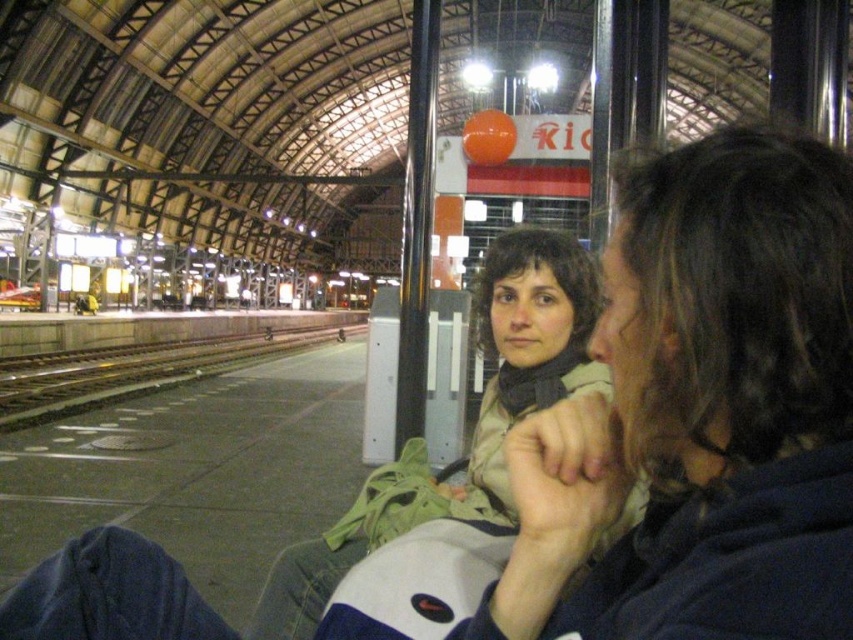
You are standing at the entrance of the train station and want to reach the point marked as point (822,515). If your stride length is 26 inches, how many full strides will you need to take to reach that point?

The distance between you and point (822,515) is 27.00 inches. Since your stride length is 26 inches, you will need to take 2 full strides to cover the distance.

You are standing at the entrance of the train station and see the point marked at coordinates (701, 412). Based on the scene description, can you identify what object this point is located on?

The point at coordinates (701, 412) is located on the matte beige scarf at center.

Consider the image. You are standing at the entrance of the train station and see the matte beige scarf at center and the green fabric jacket at center. Which item is positioned more to the right side?

The matte beige scarf at center is positioned more to the right side than the green fabric jacket at center.